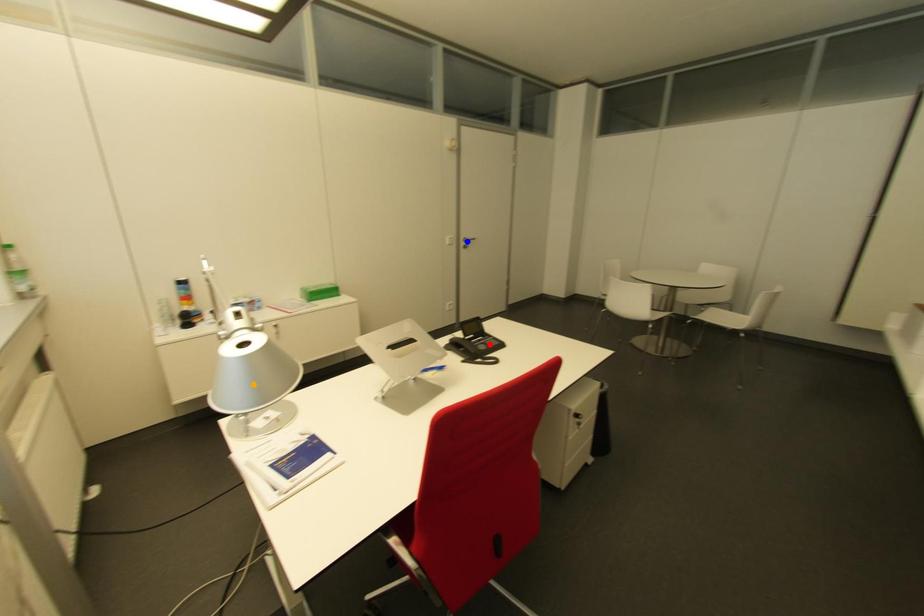
Order these from nearest to farthest:
- orange point
- red point
- blue point

orange point → red point → blue point